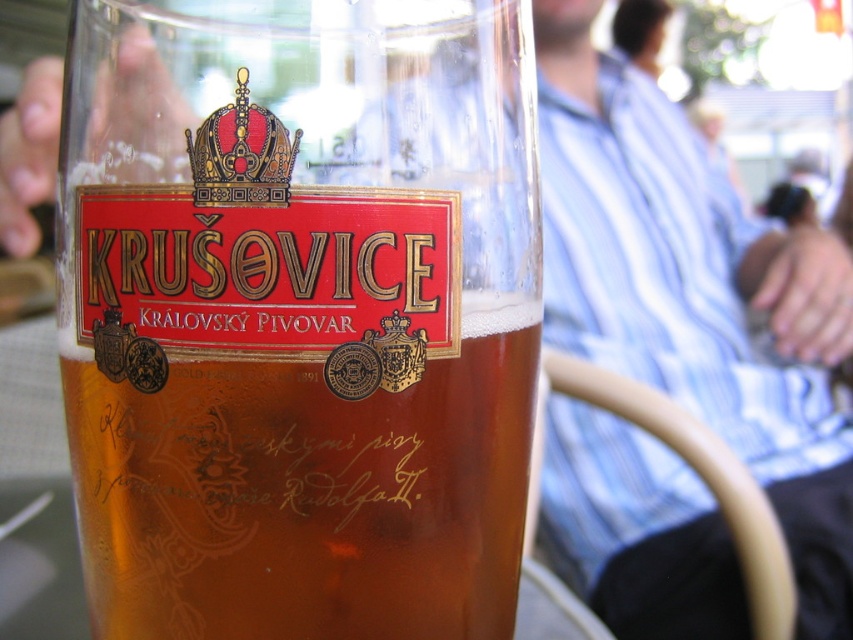
I want to click on translucent glass beer at center, so click(x=299, y=316).

Who is positioned more to the right, translucent glass beer at center or gold metallic crown at upper center?

Positioned to the right is translucent glass beer at center.

Find the location of a particular element. The height and width of the screenshot is (640, 853). translucent glass beer at center is located at coordinates (299, 316).

In order to click on translucent glass beer at center in this screenshot , I will do `click(299, 316)`.